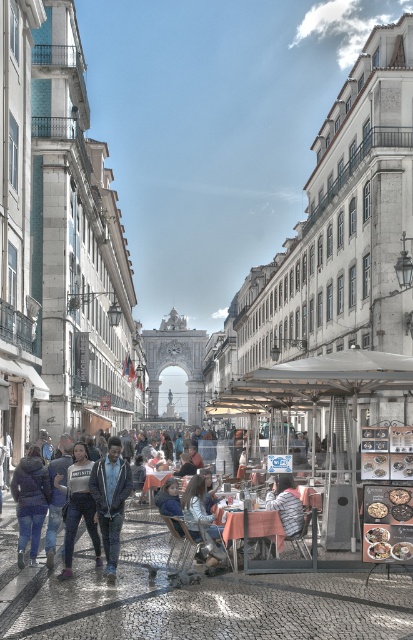
Question: Is orange fabric table at center further to the viewer compared to golden crispy pastry at center?

Choices:
 (A) yes
 (B) no

Answer: (A)

Question: Estimate the real-world distances between objects in this image. Which object is closer to the orange tablecloth at center?

Choices:
 (A) white cotton crop top at center
 (B) dark blue denim jacket at lower left

Answer: (A)

Question: Which point is farther to the camera?

Choices:
 (A) orange fabric table at center
 (B) white cotton crop top at center

Answer: (A)

Question: Which point appears closest to the camera in this image?

Choices:
 (A) (370, 513)
 (B) (104, 545)
 (C) (396, 490)

Answer: (A)

Question: Does striped shirt at center have a larger size compared to orange fabric table at center?

Choices:
 (A) yes
 (B) no

Answer: (A)

Question: Can you confirm if denim jacket at lower left is positioned below golden crispy pastry at center?

Choices:
 (A) no
 (B) yes

Answer: (B)